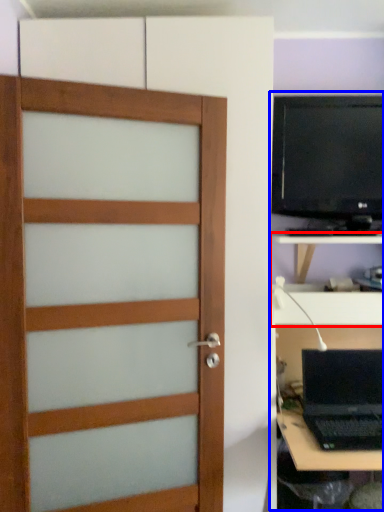
Question: Which of the following is the closest to the observer, tv cabinet (highlighted by a red box) or entertainment center (highlighted by a blue box)?

Choices:
 (A) tv cabinet
 (B) entertainment center

Answer: (B)